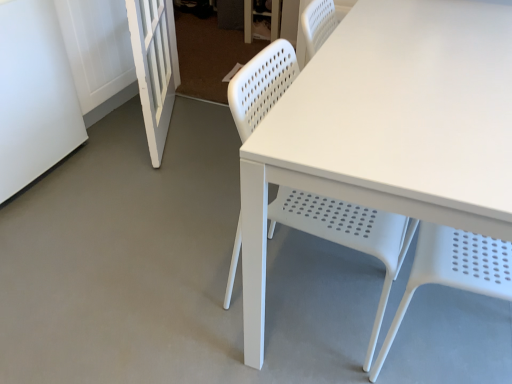
Question: Is white matte screen door at left, the 1th screen door viewed from the right, located outside white matte screen door at left, the first screen door positioned from the left?

Choices:
 (A) yes
 (B) no

Answer: (A)

Question: Is white matte screen door at left, positioned as the second screen door in left-to-right order, to the left of white matte screen door at left, which appears as the 2th screen door when viewed from the right, from the viewer's perspective?

Choices:
 (A) yes
 (B) no

Answer: (B)

Question: Is white matte screen door at left, positioned as the second screen door in left-to-right order, turned away from white matte screen door at left, the first screen door positioned from the left?

Choices:
 (A) yes
 (B) no

Answer: (A)

Question: Is white matte screen door at left, the 1th screen door viewed from the right, closer to the viewer compared to white matte screen door at left, the first screen door positioned from the left?

Choices:
 (A) no
 (B) yes

Answer: (A)

Question: Would you say white matte screen door at left, the 1th screen door viewed from the right, contains white matte screen door at left, the first screen door positioned from the left?

Choices:
 (A) yes
 (B) no

Answer: (B)

Question: Choose the correct answer: Is white matte screen door at left, the 1th screen door viewed from the right, inside white matte screen door at left, the first screen door positioned from the left, or outside it?

Choices:
 (A) outside
 (B) inside

Answer: (A)

Question: Considering the positions of white matte screen door at left, the 1th screen door viewed from the right, and white matte screen door at left, the first screen door positioned from the left, in the image, is white matte screen door at left, the 1th screen door viewed from the right, taller or shorter than white matte screen door at left, the first screen door positioned from the left,?

Choices:
 (A) tall
 (B) short

Answer: (B)

Question: Relative to white matte screen door at left, the first screen door positioned from the left, is white matte screen door at left, positioned as the second screen door in left-to-right order, in front or behind?

Choices:
 (A) behind
 (B) front

Answer: (A)

Question: From a real-world perspective, relative to white matte screen door at left, the first screen door positioned from the left, is white matte screen door at left, the 1th screen door viewed from the right, vertically above or below?

Choices:
 (A) above
 (B) below

Answer: (A)

Question: Is white matte screen door at left, the first screen door positioned from the left, to the left or to the right of white plastic chair at center in the image?

Choices:
 (A) left
 (B) right

Answer: (A)

Question: Is white matte screen door at left, which appears as the 2th screen door when viewed from the right, bigger or smaller than white plastic chair at center?

Choices:
 (A) big
 (B) small

Answer: (A)

Question: Considering the positions of white matte screen door at left, which appears as the 2th screen door when viewed from the right, and white plastic chair at center in the image, is white matte screen door at left, which appears as the 2th screen door when viewed from the right, taller or shorter than white plastic chair at center?

Choices:
 (A) short
 (B) tall

Answer: (A)

Question: Is point (35, 114) positioned closer to the camera than point (303, 218)?

Choices:
 (A) closer
 (B) farther

Answer: (B)

Question: From their relative heights in the image, would you say white plastic chair at center is taller or shorter than white matte screen door at left, the 1th screen door viewed from the right?

Choices:
 (A) short
 (B) tall

Answer: (B)

Question: From the image's perspective, is white plastic chair at center located above or below white matte screen door at left, positioned as the second screen door in left-to-right order?

Choices:
 (A) above
 (B) below

Answer: (B)